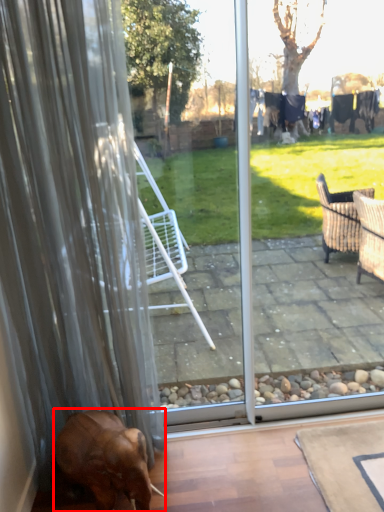
Question: From the image, what is the correct spatial relationship of dog (annotated by the red box) in relation to curtain?

Choices:
 (A) left
 (B) right

Answer: (B)